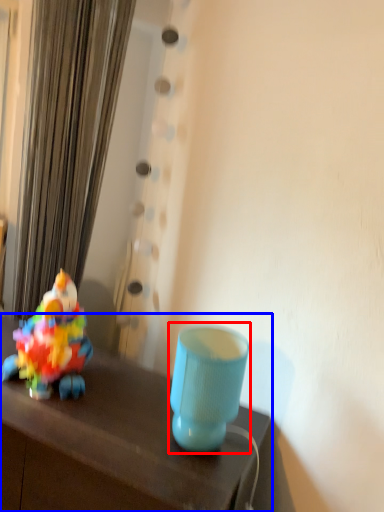
Question: Which object is further to the camera taking this photo, table lamp (highlighted by a red box) or table (highlighted by a blue box)?

Choices:
 (A) table lamp
 (B) table

Answer: (A)